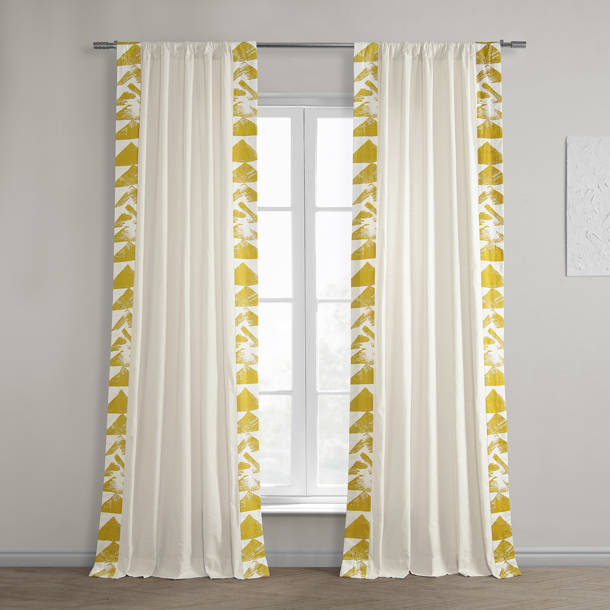
The height and width of the screenshot is (610, 610). In order to click on wall in this screenshot , I will do `click(569, 403)`.